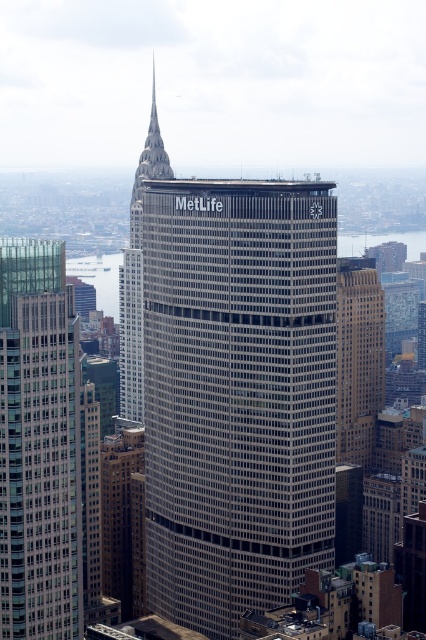
Which is more to the right, glassy reflective skyscraper at left or brown stone building at center?

brown stone building at center

The image size is (426, 640). What do you see at coordinates (39, 444) in the screenshot?
I see `glassy reflective skyscraper at left` at bounding box center [39, 444].

Where is `glassy reflective skyscraper at left`? This screenshot has width=426, height=640. glassy reflective skyscraper at left is located at coordinates (39, 444).

Between point (229, 374) and point (351, 436), which one is positioned behind?

Positioned behind is point (351, 436).

Between gray glass building at center and brown stone building at center, which one has more height?

gray glass building at center is taller.

I want to click on gray glass building at center, so click(x=236, y=394).

Does gray glass building at center have a larger size compared to glassy reflective skyscraper at left?

Yes, gray glass building at center is bigger than glassy reflective skyscraper at left.

Looking at this image, between gray glass building at center and glassy reflective skyscraper at left, which one is positioned lower?

glassy reflective skyscraper at left

Between point (181, 403) and point (34, 563), which one is positioned in front?

Point (181, 403)

Find the location of a particular element. The image size is (426, 640). gray glass building at center is located at coordinates (236, 394).